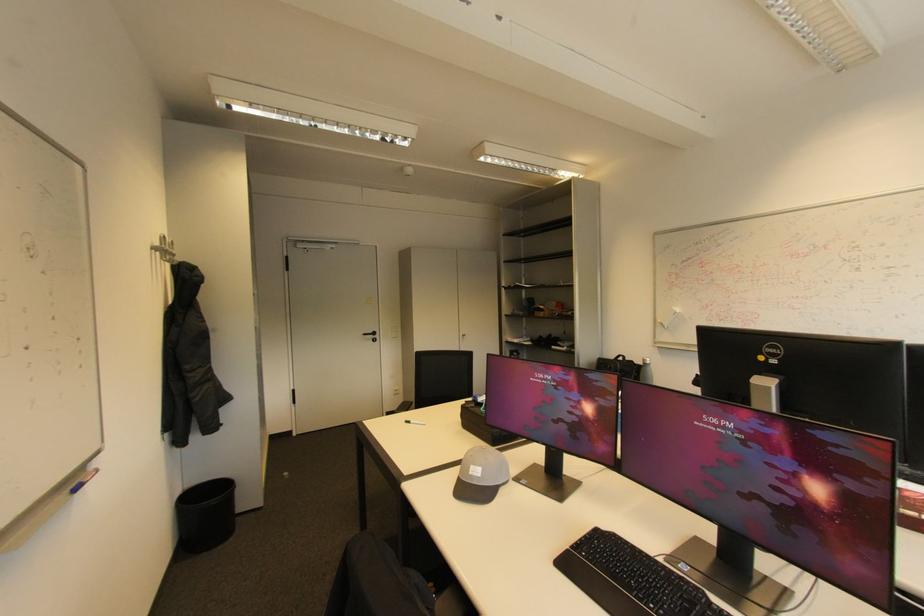
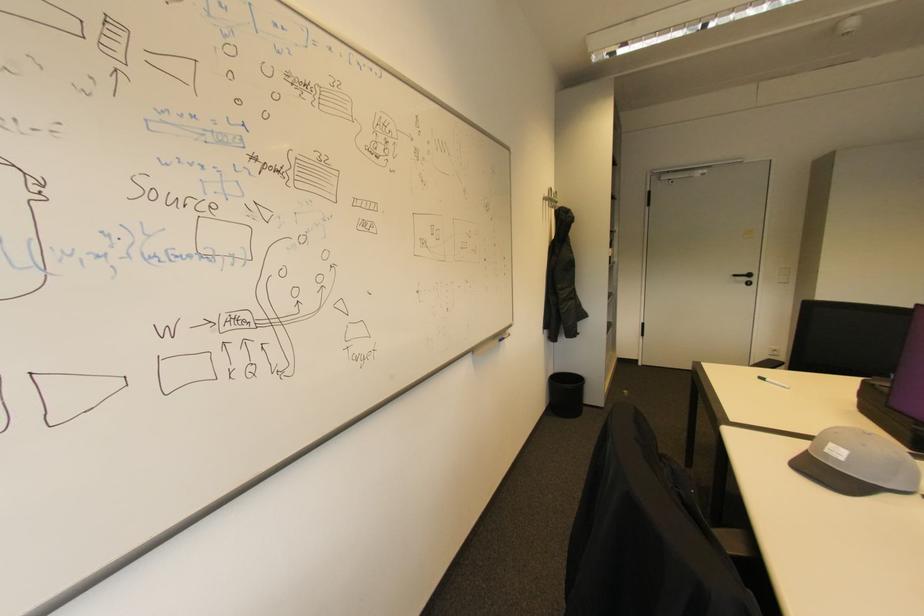
In the second image, find the point that corresponds to pixel 412 423 in the first image.

(768, 379)